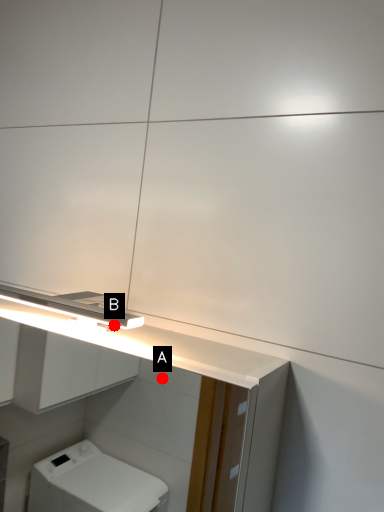
Question: Two points are circled on the image, labeled by A and B beside each circle. Which point is further to the camera?

Choices:
 (A) A is further
 (B) B is further

Answer: (A)